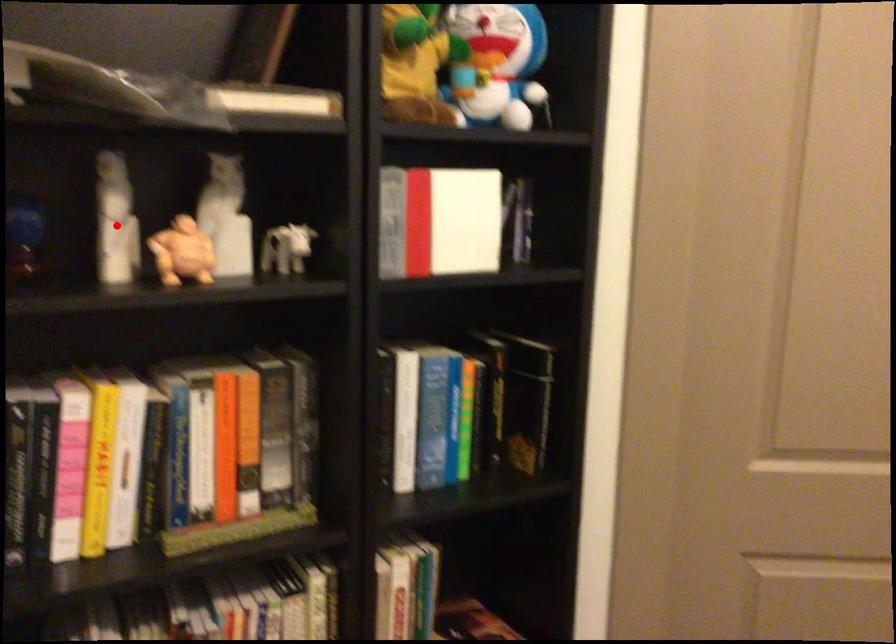
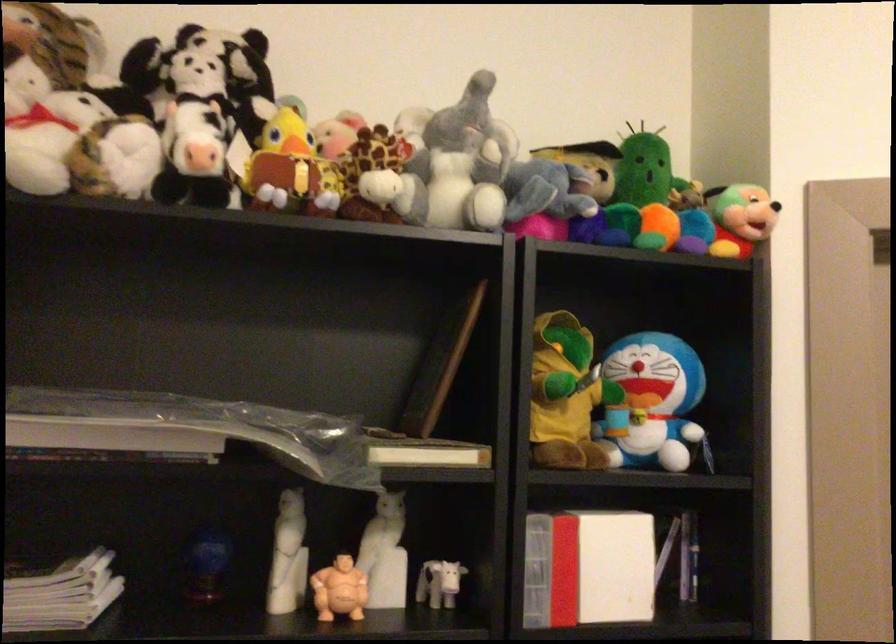
Find the pixel in the second image that matches the highlighted location in the first image.

(288, 556)